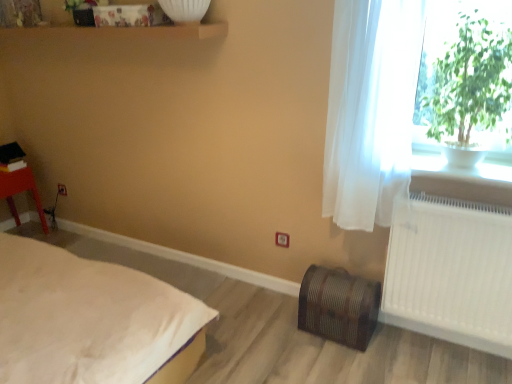
Question: Visually, is white plastic radiator at right positioned to the left or to the right of white soft bed at lower left?

Choices:
 (A) left
 (B) right

Answer: (B)

Question: Is white plastic radiator at right taller or shorter than white soft bed at lower left?

Choices:
 (A) short
 (B) tall

Answer: (A)

Question: Which object is positioned closest to the green leafy plant at upper right?

Choices:
 (A) white soft bed at lower left
 (B) white ceramic pot at upper right
 (C) white sheer curtain at right
 (D) white plastic radiator at right
 (E) matte plastic stool at left

Answer: (C)

Question: Estimate the real-world distances between objects in this image. Which object is closer to the white ceramic pot at upper right?

Choices:
 (A) matte plastic stool at left
 (B) white plastic radiator at right
 (C) white soft bed at lower left
 (D) white sheer curtain at right
 (E) green leafy plant at upper right

Answer: (E)